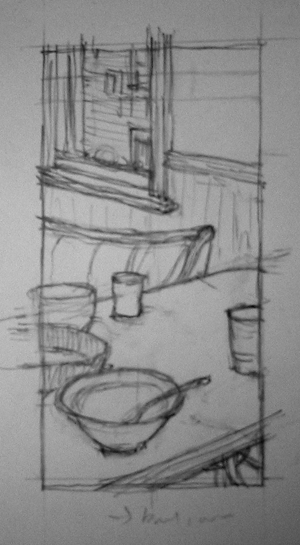
This screenshot has width=300, height=545. In order to click on window in this screenshot , I will do `click(115, 110)`.